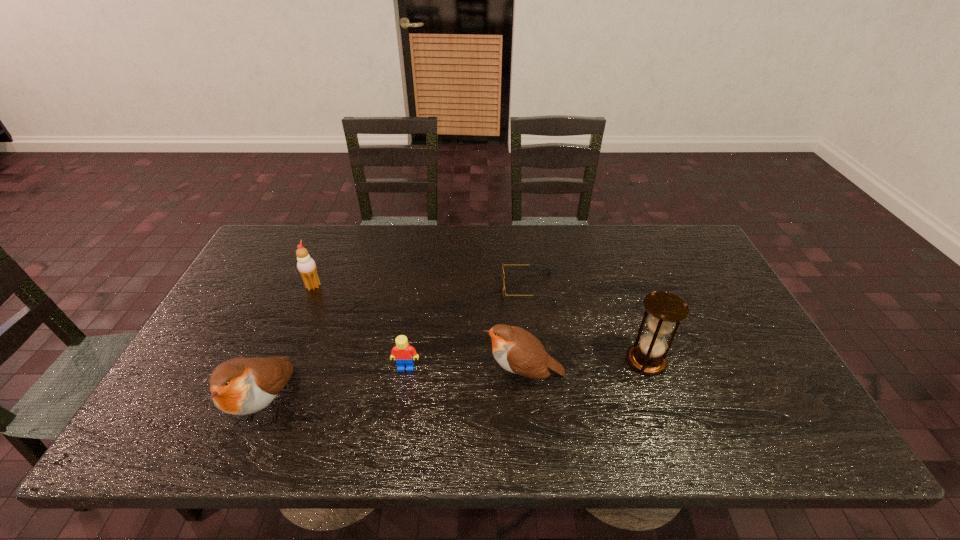
Find the location of `the taller bird`. the taller bird is located at coordinates pyautogui.click(x=239, y=386).

Where is `the right bird`? the right bird is located at coordinates coord(516,350).

You are a GUI agent. You are given a task and a screenshot of the screen. Output one action in this format:
    pyautogui.click(x=<x>, y=<y>)
    Task: Click on the icecream
    The width and height of the screenshot is (960, 540).
    Given the screenshot: What is the action you would take?
    pyautogui.click(x=306, y=265)

Image resolution: width=960 pixels, height=540 pixels. What are the coordinates of `the fifth tallest object` in the screenshot? It's located at (404, 354).

Identify the location of the third object from left to right. (404, 354).

Locate an element on the screen. sunglasses is located at coordinates (503, 275).

You are a GUI agent. You are given a task and a screenshot of the screen. Output one action in this format:
    pyautogui.click(x=<x>, y=<y>)
    Task: Click on the rightmost object
    
    Given the screenshot: What is the action you would take?
    click(x=667, y=310)

Identify the location of free spot located 0.370m at the face of the shorter bird. (332, 375).

The width and height of the screenshot is (960, 540). In order to click on vacant space situated 0.280m at the face of the shorter bird in this screenshot , I will do `click(369, 375)`.

The image size is (960, 540). Find the location of `free space located 0.100m at the face of the shorter bird`. free space located 0.100m at the face of the shorter bird is located at coordinates (442, 375).